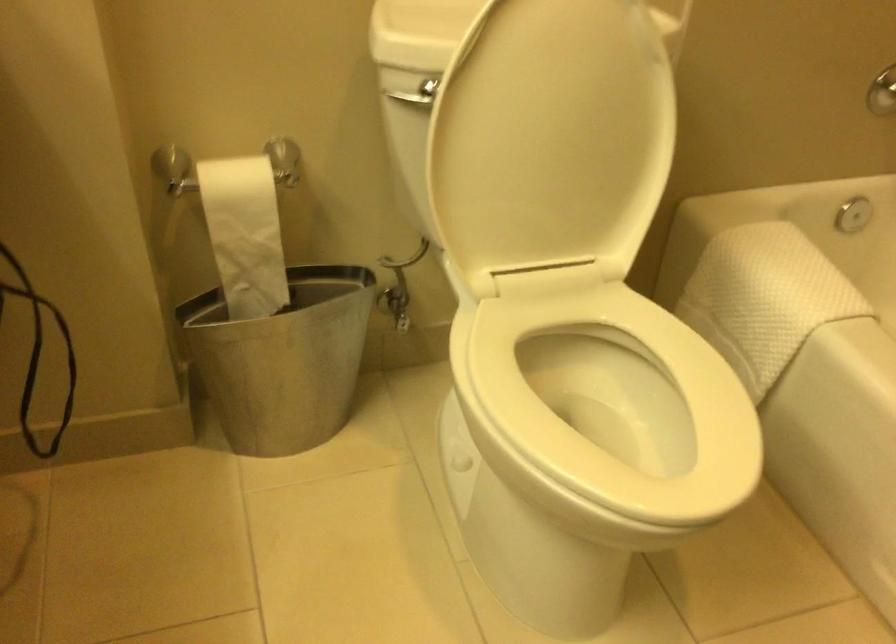
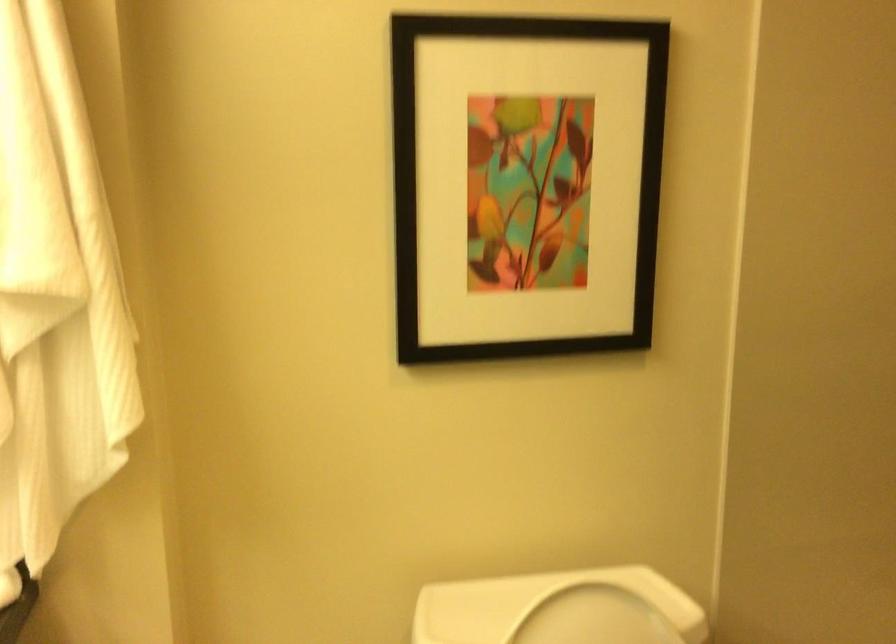
Which direction would the cameraman need to move to produce the second image?

The cameraman moved toward right, backward.